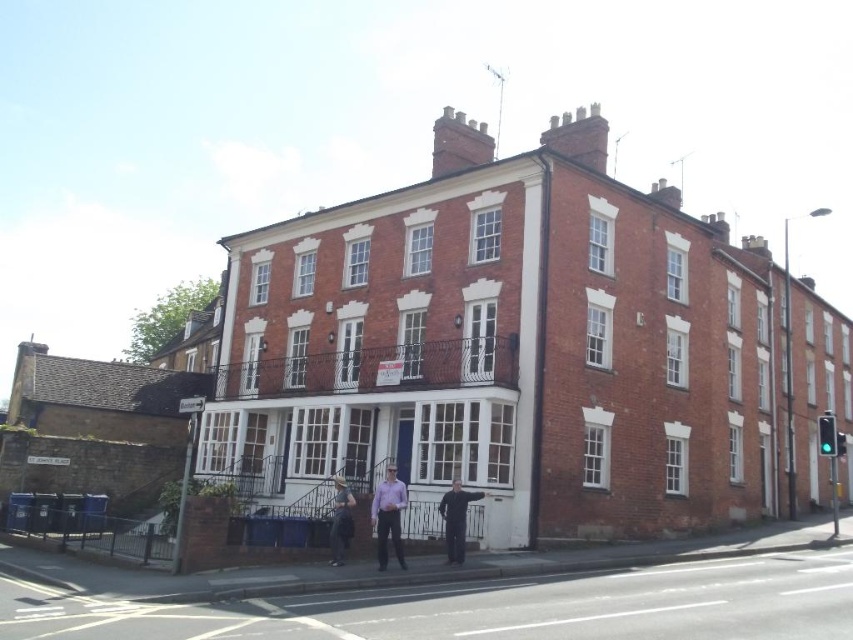
You are a tailor who needs to determine if a purple cotton shirt at center can be placed inside a garment bag designed for dark blue jeans at center. The garment bag is exactly the width of the jeans. Will the shirt fit?

The purple cotton shirt at center has a width less than dark blue jeans at center, so it will fit inside the garment bag designed for the jeans.

You are standing in front of the two story brick building and notice a purple cotton shirt at center. Where exactly is the purple cotton shirt located in terms of coordinates?

The purple cotton shirt at center is located at point (387,516).

Consider the image. You are standing in front of the two story brick building and notice a person wearing a purple cotton shirt at center and dark blue jeans at center. Which piece of clothing is closer to you?

The purple cotton shirt at center is in front of the dark blue jeans at center, so the purple cotton shirt at center is closer to you.